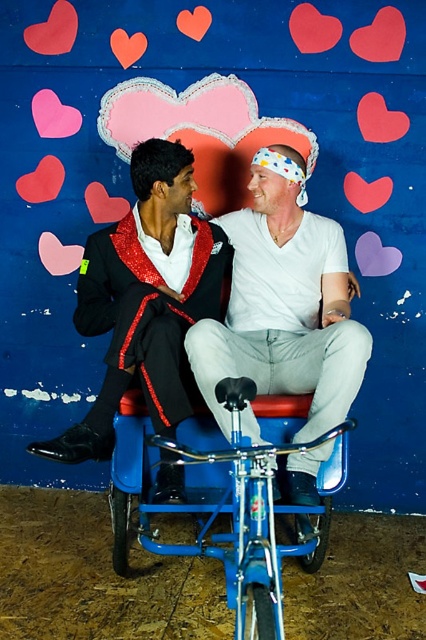
Is shiny sequined suit at center to the left of blue metallic bicycle at center from the viewer's perspective?

Indeed, shiny sequined suit at center is positioned on the left side of blue metallic bicycle at center.

Is shiny sequined suit at center to the right of blue metallic bicycle at center from the viewer's perspective?

In fact, shiny sequined suit at center is to the left of blue metallic bicycle at center.

Which is behind, point (118, 336) or point (281, 609)?

Positioned behind is point (118, 336).

Identify the location of shiny sequined suit at center. This screenshot has width=426, height=640. (143, 301).